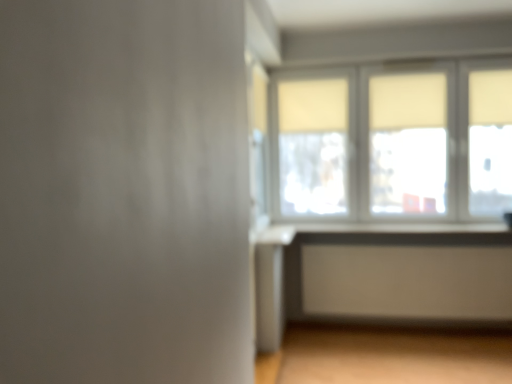
The image size is (512, 384). Describe the element at coordinates (392, 142) in the screenshot. I see `matte glass window at upper right` at that location.

Where is `matte glass window at upper right`? The width and height of the screenshot is (512, 384). matte glass window at upper right is located at coordinates 392,142.

Measure the distance between point [290,181] and camera.

The depth of point [290,181] is 13.61 feet.

Find the location of `matte glass window at upper right`. matte glass window at upper right is located at coordinates (392, 142).